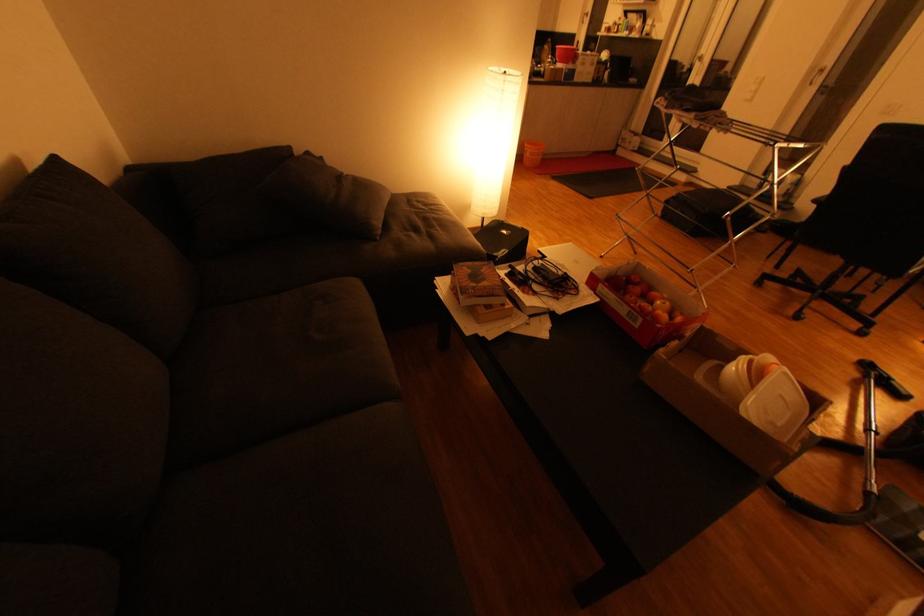
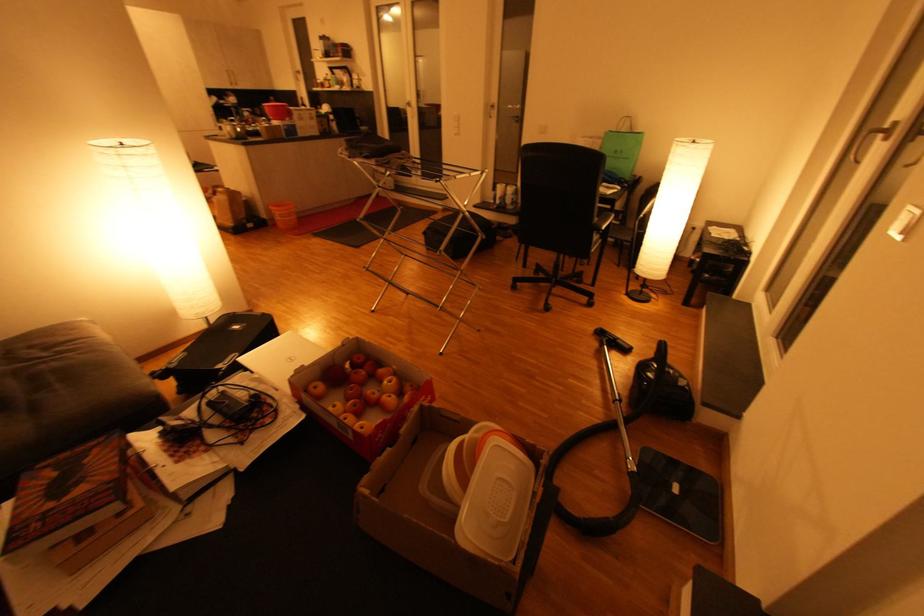
Locate, in the second image, the point that corresponds to point (860, 359) in the first image.

(597, 330)